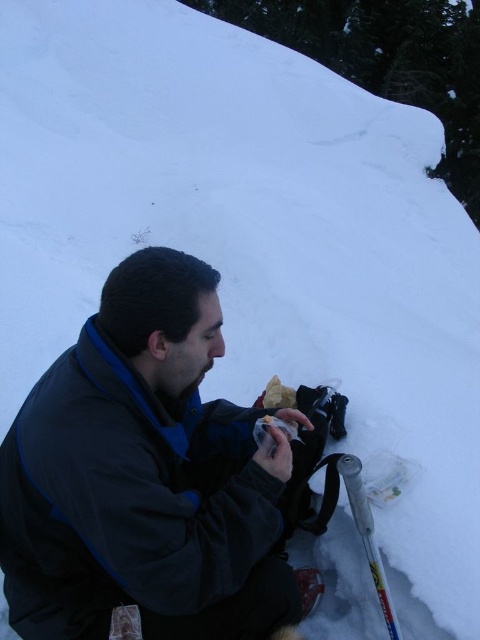
Consider the image. You are a photographer trying to capture a closeup of the dark blue fleece jacket at center without the silver metallic ski pole at lower right appearing in the frame. Based on their positions, can you position yourself in a way that the ski pole is fully out of the shot?

The dark blue fleece jacket at center is in front of the silver metallic ski pole at lower right. By moving your camera position slightly forward towards the jacket, you can ensure the ski pole is hidden behind the jacket and thus out of the frame.

You are a photographer trying to capture a photo of the dark blue fleece jacket at center and the silver metallic ski pole at lower right. Since you want to ensure both objects are in focus, you need to know which one is taller. Can you determine which object is taller?

The dark blue fleece jacket at center has a greater height compared to the silver metallic ski pole at lower right, so the dark blue fleece jacket at center is taller.

You are an AI analyzing the image. The scene shows a person in a winter setting. Where is the dark blue fleece jacket at center located in terms of coordinates?

The dark blue fleece jacket at center is located at coordinates point (145, 476).